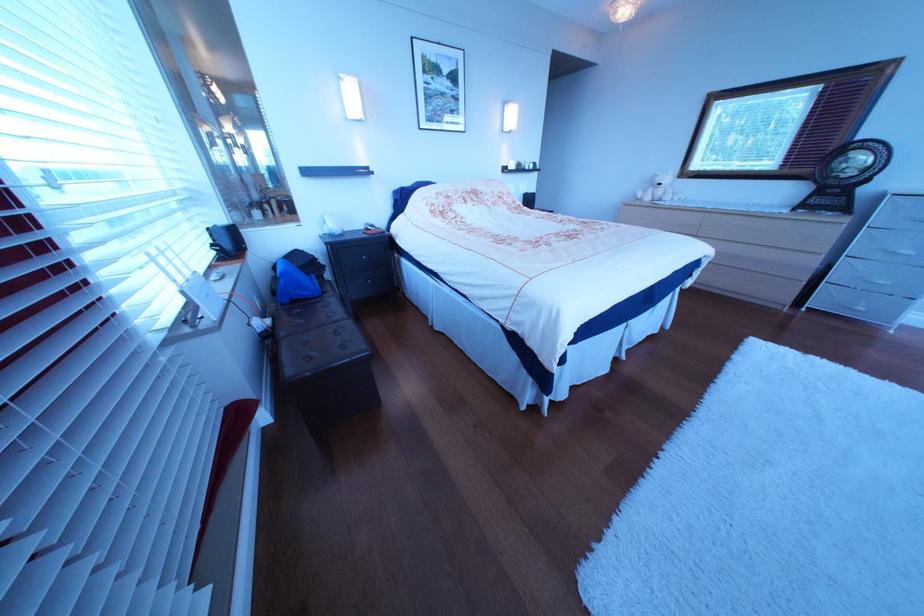
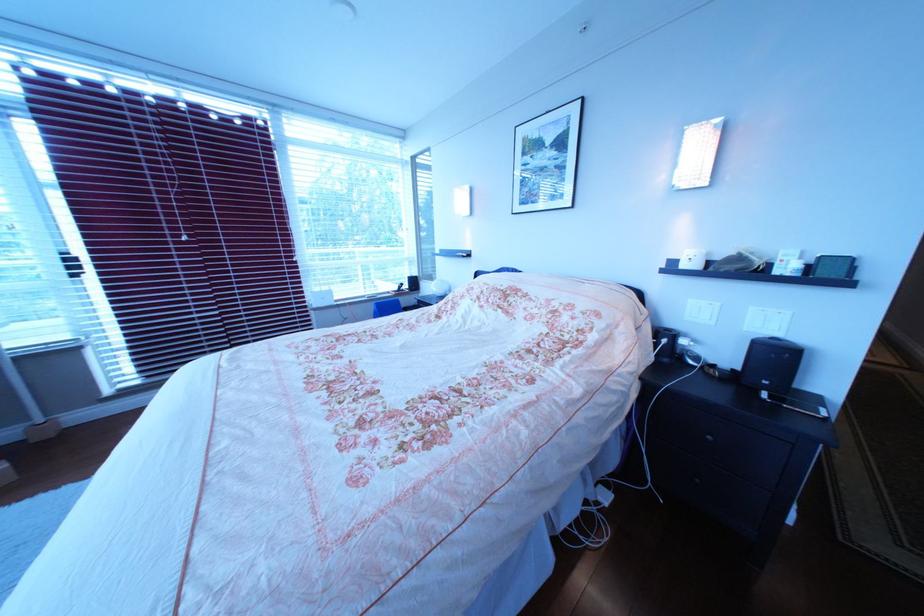
In the second image, find the point that corresponds to [525,169] in the first image.

(699, 267)